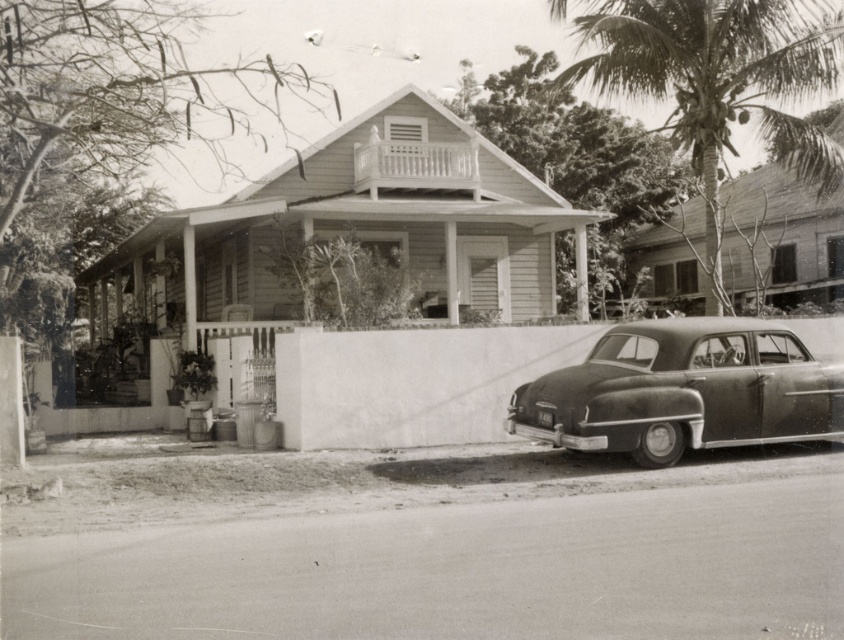
You are a delivery person trying to park your van in front of the house. The shiny black sedan at lower right is already parked there. There is a coarse textured palm tree at upper right nearby. Which object is taller, the palm tree or the sedan?

The coarse textured palm tree at upper right is taller than the shiny black sedan at lower right.

You are standing on the front porch of the house and want to look at the shiny black sedan at lower right. Which direction should you turn your head to also see the coarse textured palm tree at upper right?

You should turn your head to the right to see both the shiny black sedan at lower right and the coarse textured palm tree at upper right since the coarse textured palm tree at upper right is located to the right of the shiny black sedan at lower right.